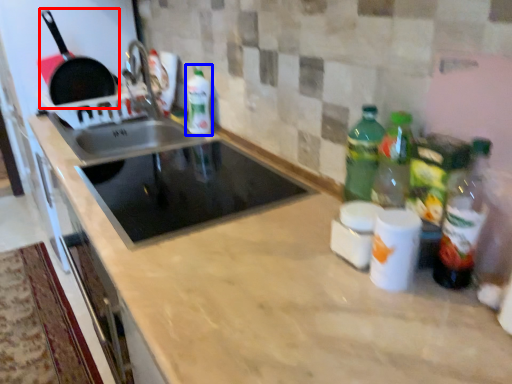
Question: Among these objects, which one is farthest to the camera, frying pan (highlighted by a red box) or bottle (highlighted by a blue box)?

Choices:
 (A) frying pan
 (B) bottle

Answer: (A)